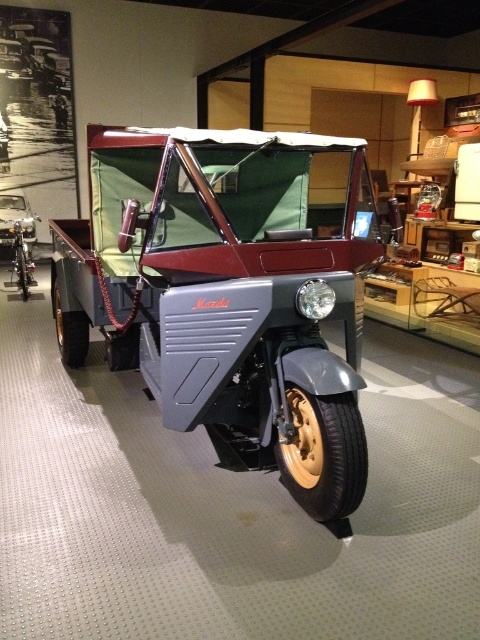
Which is in front, point (168, 380) or point (0, 220)?

Point (168, 380) is more forward.

Is metallic gray jeep at center thinner than shiny silver car at left?

No, metallic gray jeep at center is not thinner than shiny silver car at left.

The width and height of the screenshot is (480, 640). Identify the location of metallic gray jeep at center. (229, 292).